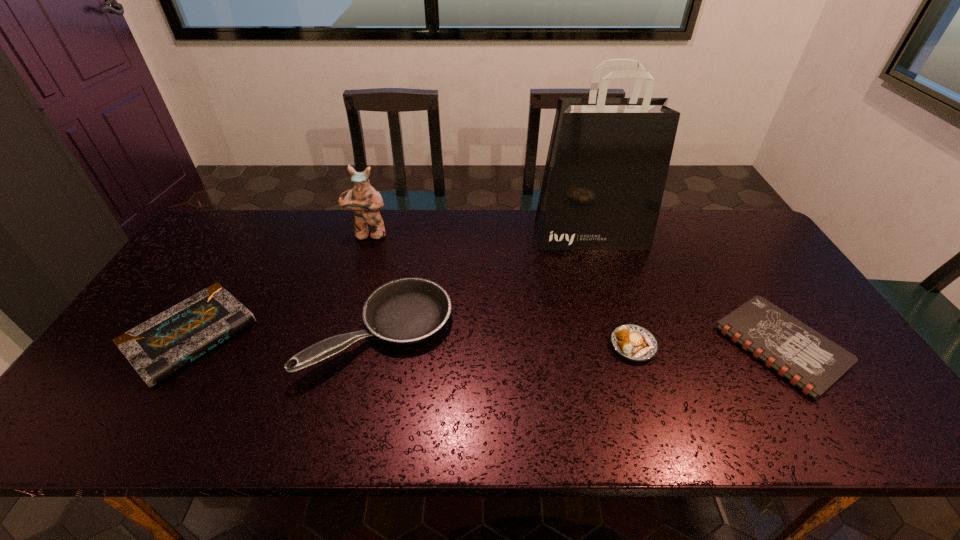
You are a GUI agent. You are given a task and a screenshot of the screen. Output one action in this format:
    pyautogui.click(x=<x>, y=<y>)
    Task: Click on the tallest object
    This screenshot has height=540, width=960.
    Given the screenshot: What is the action you would take?
    pyautogui.click(x=608, y=159)

This screenshot has height=540, width=960. I want to click on figurine, so click(365, 202).

This screenshot has width=960, height=540. In order to click on the third tallest object in this screenshot , I will do `click(408, 310)`.

You are a GUI agent. You are given a task and a screenshot of the screen. Output one action in this format:
    pyautogui.click(x=<x>, y=<y>)
    Task: Click on the pastry
    The height and width of the screenshot is (540, 960).
    Given the screenshot: What is the action you would take?
    pyautogui.click(x=634, y=342)

Find the location of `the left notebook`. the left notebook is located at coordinates (158, 348).

The height and width of the screenshot is (540, 960). What are the coordinates of `the taller notebook` in the screenshot? It's located at (158, 348).

You are a GUI agent. You are given a task and a screenshot of the screen. Output one action in this format:
    pyautogui.click(x=<x>, y=<y>)
    Task: Click on the shorter notebook
    The image size is (960, 540).
    Given the screenshot: What is the action you would take?
    pyautogui.click(x=807, y=359)

Find the location of a particular element. The width and height of the screenshot is (960, 540). the right notebook is located at coordinates (807, 359).

You are a GUI agent. You are given a task and a screenshot of the screen. Output one action in this format:
    pyautogui.click(x=<x>, y=<y>)
    Task: Click on the free space located on the front with handles of the tallest object
    The width and height of the screenshot is (960, 540).
    Given the screenshot: What is the action you would take?
    pyautogui.click(x=607, y=290)

Find the location of a particular element. free spot located on the front-facing side of the figurine is located at coordinates (359, 267).